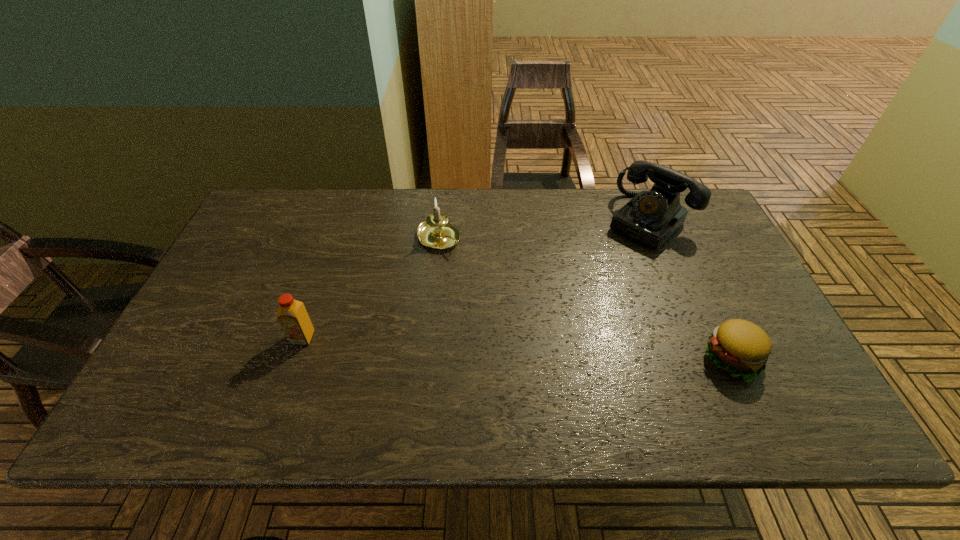
Identify the location of the leftmost object. (292, 315).

Locate an element on the screen. The height and width of the screenshot is (540, 960). the shortest object is located at coordinates (740, 347).

Locate an element on the screen. The width and height of the screenshot is (960, 540). the tallest object is located at coordinates (650, 218).

Find the location of a particular element. Image resolution: width=960 pixels, height=540 pixels. the second object from left to right is located at coordinates (436, 232).

The image size is (960, 540). Identify the location of vacant space located 0.090m on the front and back of the orange juice. (289, 380).

This screenshot has height=540, width=960. Find the location of `vacant space located on the left of the hamburger`. vacant space located on the left of the hamburger is located at coordinates (631, 359).

Where is `vacant area located 0.050m on the dial of the tallest object`? This screenshot has width=960, height=540. vacant area located 0.050m on the dial of the tallest object is located at coordinates (619, 253).

Where is `blank area located 0.110m on the dial of the tallest object`? The height and width of the screenshot is (540, 960). blank area located 0.110m on the dial of the tallest object is located at coordinates (608, 263).

You are a GUI agent. You are given a task and a screenshot of the screen. Output one action in this format:
    pyautogui.click(x=<x>, y=<y>)
    Task: Click on the free spot located 0.230m on the dial of the tallest object
    
    Given the screenshot: What is the action you would take?
    pyautogui.click(x=584, y=286)

The height and width of the screenshot is (540, 960). What are the coordinates of `free spot located on the handle side of the second object from left to right` in the screenshot? It's located at (480, 275).